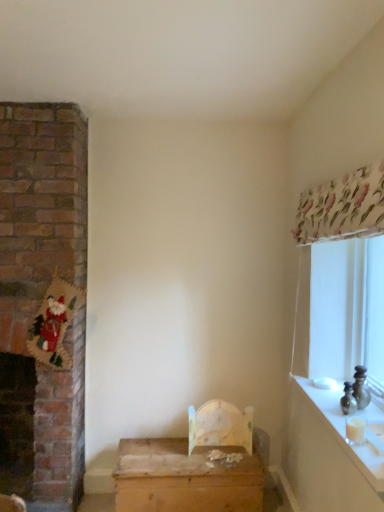
Locate an element on the screen. This screenshot has width=384, height=512. free space above wooden chest at center (from a real-world perspective) is located at coordinates (202, 453).